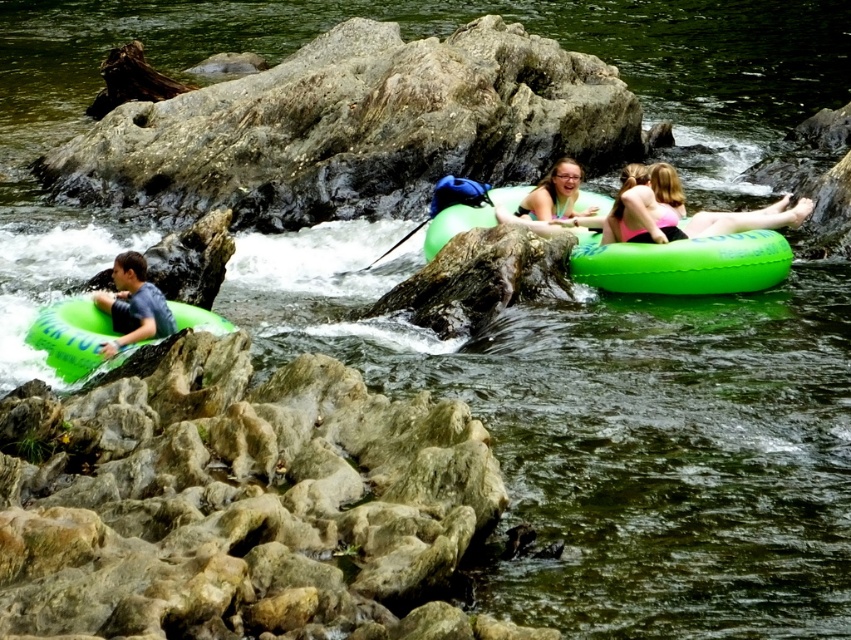
Which is below, pink fabric bikini at upper right or translucent green tube at center?

pink fabric bikini at upper right is lower down.

Does pink fabric bikini at upper right have a smaller size compared to translucent green tube at center?

Actually, pink fabric bikini at upper right might be larger than translucent green tube at center.

Locate an element on the screen. The height and width of the screenshot is (640, 851). pink fabric bikini at upper right is located at coordinates (680, 212).

Image resolution: width=851 pixels, height=640 pixels. Identify the location of pink fabric bikini at upper right. click(x=680, y=212).

Consider the image. Between green rubber raft at center and green rubber tube at left, which one appears on the right side from the viewer's perspective?

From the viewer's perspective, green rubber raft at center appears more on the right side.

Which is below, green rubber raft at center or green rubber tube at left?

green rubber tube at left is lower down.

Who is more distant from viewer, (x=705, y=289) or (x=84, y=321)?

The point (x=705, y=289) is more distant.

In order to click on green rubber raft at center in this screenshot , I will do `click(683, 262)`.

Between point (609, 237) and point (44, 336), which one is positioned behind?

The point (609, 237) is more distant.

This screenshot has width=851, height=640. I want to click on pink fabric bikini at upper right, so click(x=680, y=212).

The width and height of the screenshot is (851, 640). Identify the location of pink fabric bikini at upper right. (680, 212).